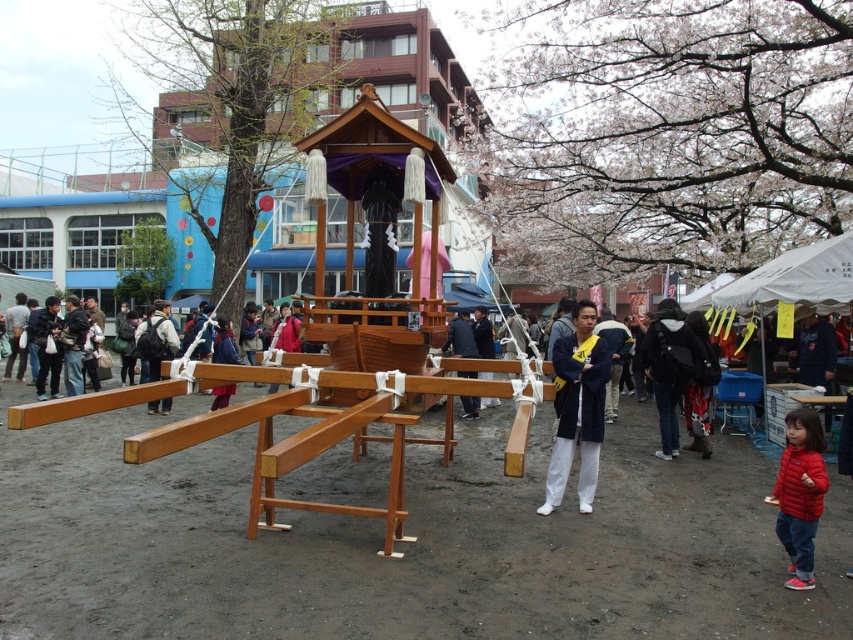
Question: Among these objects, which one is farthest from the camera?

Choices:
 (A) red fleece jacket at lower right
 (B) dark blue fabric at center
 (C) dark fabric jacket at center
 (D) blue silk kimono at center

Answer: (B)

Question: Does blue silk kimono at center have a greater width compared to dark fabric jacket at center?

Choices:
 (A) yes
 (B) no

Answer: (A)

Question: Which of the following is the closest to the observer?

Choices:
 (A) white fabric canopy at upper right
 (B) dark fabric jacket at center
 (C) blue silk kimono at center
 (D) dark blue fabric at center

Answer: (C)

Question: Which point appears closest to the camera in this image?

Choices:
 (A) (666, 323)
 (B) (469, 412)
 (C) (824, 272)
 (D) (689, 429)

Answer: (A)

Question: Is blue silk kimono at center positioned behind red fleece jacket at lower right?

Choices:
 (A) yes
 (B) no

Answer: (A)

Question: Does blue silk kimono at center have a lesser width compared to dark fabric jacket at center?

Choices:
 (A) no
 (B) yes

Answer: (A)